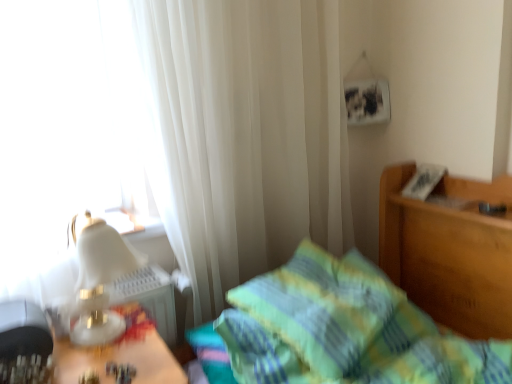
What is the approximate height of white glossy table lamp at left?

The height of white glossy table lamp at left is 31.40 centimeters.

What is the approximate width of white sheer curtain at upper left?

white sheer curtain at upper left is 7.45 inches wide.

Locate an element on the screen. This screenshot has height=384, width=512. white glossy table lamp at left is located at coordinates (100, 281).

Between white glossy table lamp at left and green plaid bedspread at center, which one has larger size?

green plaid bedspread at center.

Considering the sizes of objects white glossy table lamp at left and green plaid bedspread at center in the image provided, who is taller, white glossy table lamp at left or green plaid bedspread at center?

Standing taller between the two is green plaid bedspread at center.

How different are the orientations of white glossy table lamp at left and green plaid bedspread at center in degrees?

The facing directions of white glossy table lamp at left and green plaid bedspread at center are 88.3 degrees apart.

Where is `table lamp behind the green plaid bedspread at center`? table lamp behind the green plaid bedspread at center is located at coordinates (100, 281).

Which object is wider, white glossy table lamp at left or white sheer curtain at upper left?

Wider between the two is white glossy table lamp at left.

From a real-world perspective, which is physically below, white glossy table lamp at left or white sheer curtain at upper left?

white glossy table lamp at left, from a real-world perspective.

Looking at this image, considering the relative sizes of white glossy table lamp at left and white sheer curtain at upper left in the image provided, is white glossy table lamp at left smaller than white sheer curtain at upper left?

Indeed, white glossy table lamp at left has a smaller size compared to white sheer curtain at upper left.

Who is shorter, white glossy table lamp at left or white sheer curtain at upper left?

white glossy table lamp at left is shorter.

Looking at this image, is green plaid pillow at center facing away from white glossy table lamp at left?

No, green plaid pillow at center is not facing away from white glossy table lamp at left.

Is the surface of green plaid pillow at center in direct contact with white glossy table lamp at left?

No, green plaid pillow at center is not in contact with white glossy table lamp at left.

Considering the positions of point (315, 372) and point (114, 322), is point (315, 372) closer or farther from the camera than point (114, 322)?

Point (315, 372) is closer to the camera than point (114, 322).

Consider the image. How different are the orientations of green plaid pillow at center and white glossy table lamp at left in degrees?

The facing directions of green plaid pillow at center and white glossy table lamp at left are 22.7 degrees apart.

Can you see green plaid bedspread at center touching white glossy table lamp at left?

No, green plaid bedspread at center is not touching white glossy table lamp at left.

Can you confirm if green plaid bedspread at center is wider than white glossy table lamp at left?

Indeed, green plaid bedspread at center has a greater width compared to white glossy table lamp at left.

From a real-world perspective, is green plaid bedspread at center on top of white glossy table lamp at left?

No.

Which is more to the right, green plaid bedspread at center or white glossy table lamp at left?

From the viewer's perspective, green plaid bedspread at center appears more on the right side.

Is green plaid bedspread at center beside white sheer curtain at upper left?

No, green plaid bedspread at center is not with white sheer curtain at upper left.

Consider the image. From the image's perspective, relative to white sheer curtain at upper left, is green plaid bedspread at center above or below?

green plaid bedspread at center is below white sheer curtain at upper left.

At what (x,y) coordinates should I click in order to perform the action: click on bed that appears in front of the white sheer curtain at upper left. Please return your answer as a coordinate pair (x, y). Looking at the image, I should click on (450, 251).

How much distance is there between green plaid bedspread at center and white sheer curtain at upper left?

green plaid bedspread at center and white sheer curtain at upper left are 19.80 inches apart from each other.

Considering the positions of point (173, 233) and point (499, 183), is point (173, 233) closer or farther from the camera than point (499, 183)?

Point (173, 233) is closer to the camera than point (499, 183).

Is white sheer curtain at upper left at the left side of green plaid bedspread at center?

Yes, white sheer curtain at upper left is to the left of green plaid bedspread at center.

Considering the sizes of objects white sheer curtain at upper left and green plaid bedspread at center in the image provided, who is wider, white sheer curtain at upper left or green plaid bedspread at center?

green plaid bedspread at center.

Is point (218, 9) more distant than point (90, 294)?

Yes.

Considering the sizes of objects white sheer curtain at upper left and white glossy table lamp at left in the image provided, who is taller, white sheer curtain at upper left or white glossy table lamp at left?

white sheer curtain at upper left.

From a real-world perspective, who is located lower, white sheer curtain at upper left or white glossy table lamp at left?

white glossy table lamp at left is physically lower.

Locate an element on the screen. bed lying on the right of white glossy table lamp at left is located at coordinates (450, 251).

The height and width of the screenshot is (384, 512). I want to click on curtain that appears above the white glossy table lamp at left (from a real-world perspective), so click(x=244, y=134).

Estimate the real-world distances between objects in this image. Which object is further from white glossy table lamp at left, green plaid bedspread at center or white sheer curtain at upper left?

green plaid bedspread at center is further to white glossy table lamp at left.

Which object lies further to the anchor point white sheer curtain at upper left, green plaid pillow at center or green plaid bedspread at center?

green plaid bedspread at center.

Estimate the real-world distances between objects in this image. Which object is further from white glossy table lamp at left, green plaid bedspread at center or green plaid pillow at center?

green plaid bedspread at center lies further to white glossy table lamp at left than the other object.

When comparing their distances from green plaid pillow at center, does white sheer curtain at upper left or white glossy table lamp at left seem further?

white glossy table lamp at left.

From the image, which object appears to be nearer to green plaid pillow at center, green plaid bedspread at center or white glossy table lamp at left?

Among the two, green plaid bedspread at center is located nearer to green plaid pillow at center.

Estimate the real-world distances between objects in this image. Which object is closer to white sheer curtain at upper left, white glossy table lamp at left or green plaid bedspread at center?

green plaid bedspread at center.

Based on their spatial positions, is white sheer curtain at upper left or green plaid bedspread at center closer to green plaid pillow at center?

The object closer to green plaid pillow at center is white sheer curtain at upper left.

From the picture: Looking at the image, which one is located further to green plaid pillow at center, white glossy table lamp at left or green plaid bedspread at center?

white glossy table lamp at left.

The height and width of the screenshot is (384, 512). Find the location of `curtain between white glossy table lamp at left and green plaid pillow at center`. curtain between white glossy table lamp at left and green plaid pillow at center is located at coordinates (244, 134).

Where is `pillow between green plaid bedspread at center and white sheer curtain at upper left from front to back`? This screenshot has height=384, width=512. pillow between green plaid bedspread at center and white sheer curtain at upper left from front to back is located at coordinates (322, 306).

This screenshot has height=384, width=512. I want to click on curtain between white glossy table lamp at left and green plaid bedspread at center in the horizontal direction, so click(244, 134).

In order to click on pillow between white glossy table lamp at left and green plaid bedspread at center in this screenshot , I will do `click(322, 306)`.